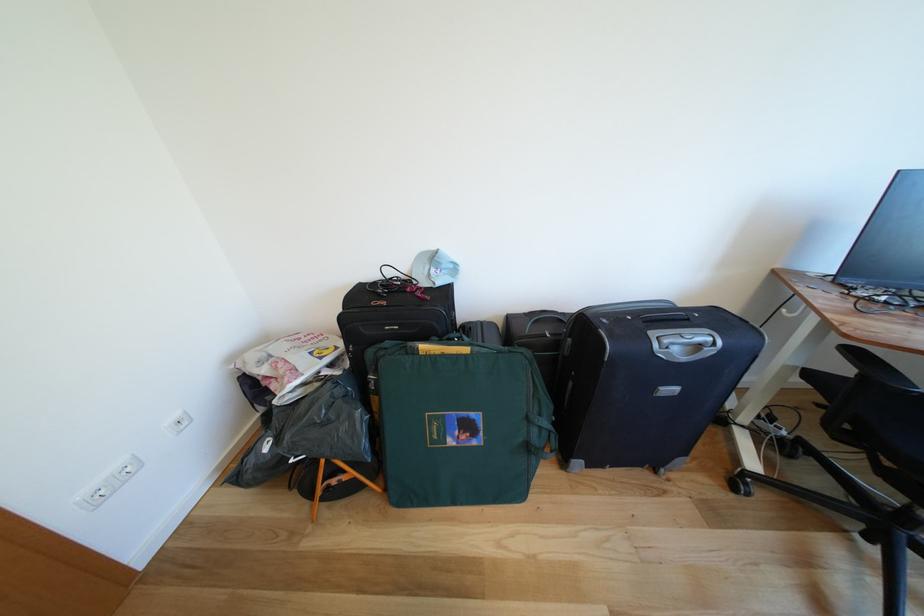
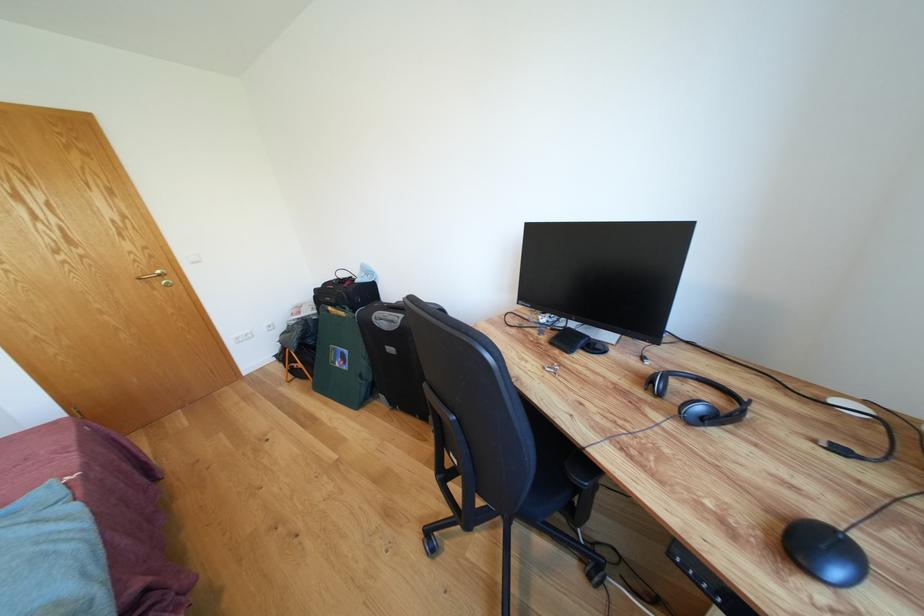
Locate, in the second image, the point that corresponds to point (708, 344) in the first image.

(398, 322)